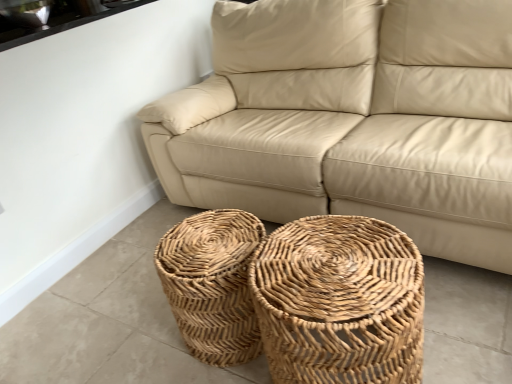
Locate an element on the screen. vacant area to the right of natural woven basket at center, positioned as the 2th basket in left-to-right order is located at coordinates (462, 328).